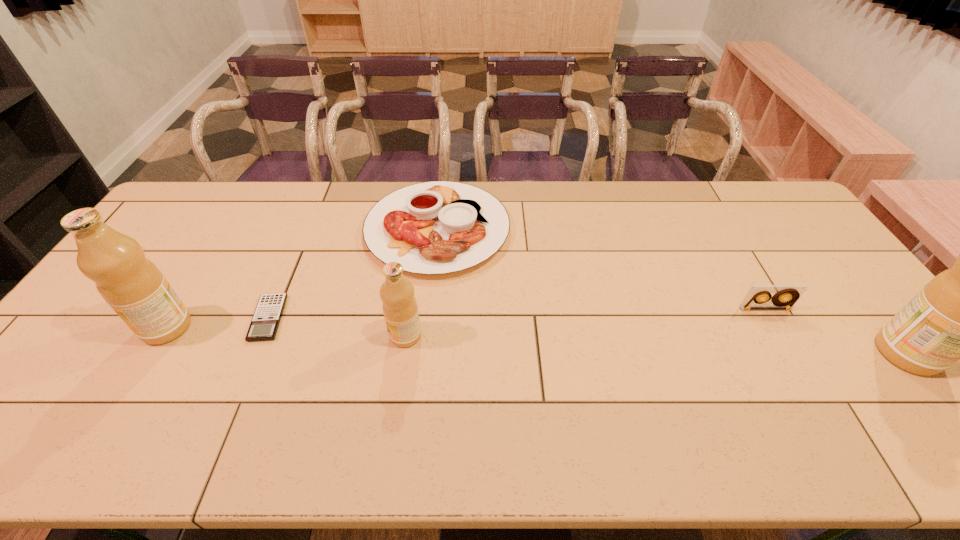
Identify which olive oil is the second closest to the second shortest object. Please provide its 2D coordinates. Your answer should be formatted as a tuple, i.e. [(x, y)], where the tuple contains the x and y coordinates of a point satisfying the conditions above.

[(133, 286)]

The width and height of the screenshot is (960, 540). I want to click on vacant region that satisfies the following two spatial constraints: 1. at the front of the third shortest object with visible reels; 2. on the label of the second olive oil from right to left, so click(x=780, y=335).

I want to click on free space that satisfies the following two spatial constraints: 1. at the front of the fifth object from left to right with visible reels; 2. on the label of the second shortest olive oil, so click(776, 327).